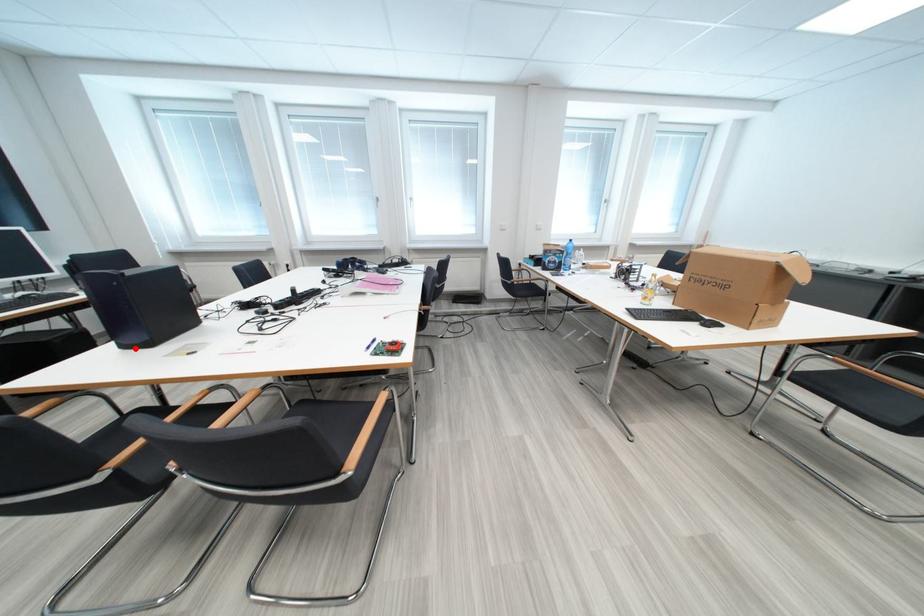
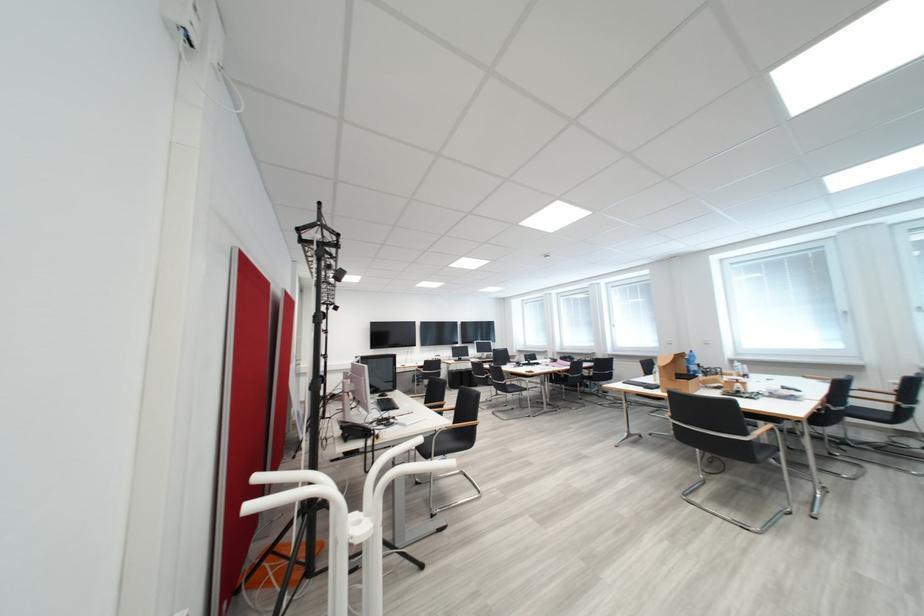
Question: I am providing you with two images of the same scene from different viewpoints. A red point is marked on the first image. Can you still see the location of the red point in image 2?

Choices:
 (A) Yes
 (B) No

Answer: (B)